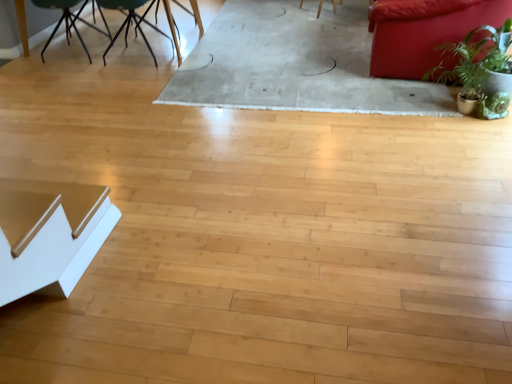
Locate an element on the screen. empty space that is to the right of white glossy table at lower left is located at coordinates (112, 282).